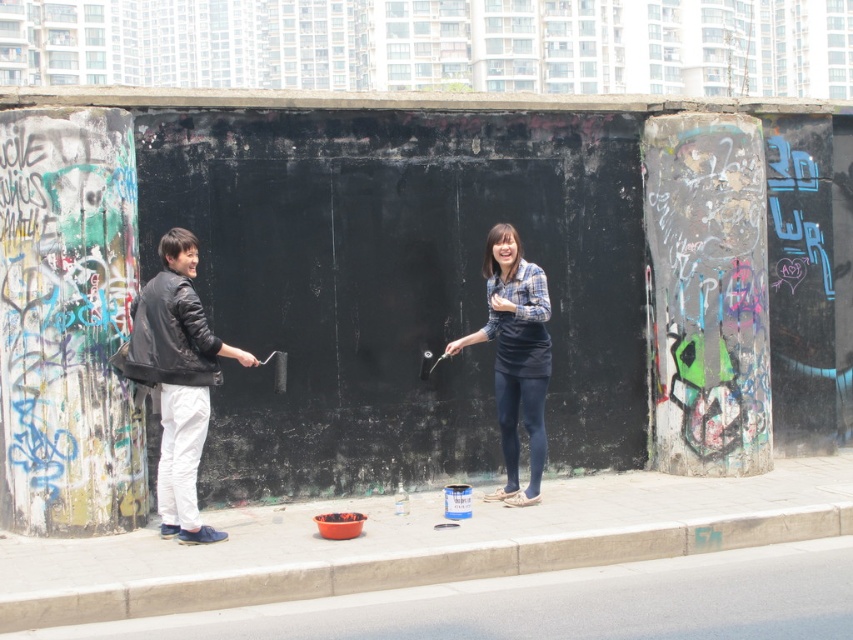
Does black leather jacket at left come behind blue plaid shirt at center?

That is False.

Can you confirm if black leather jacket at left is positioned to the right of blue plaid shirt at center?

No, black leather jacket at left is not to the right of blue plaid shirt at center.

Where is `black leather jacket at left`? black leather jacket at left is located at coordinates (177, 380).